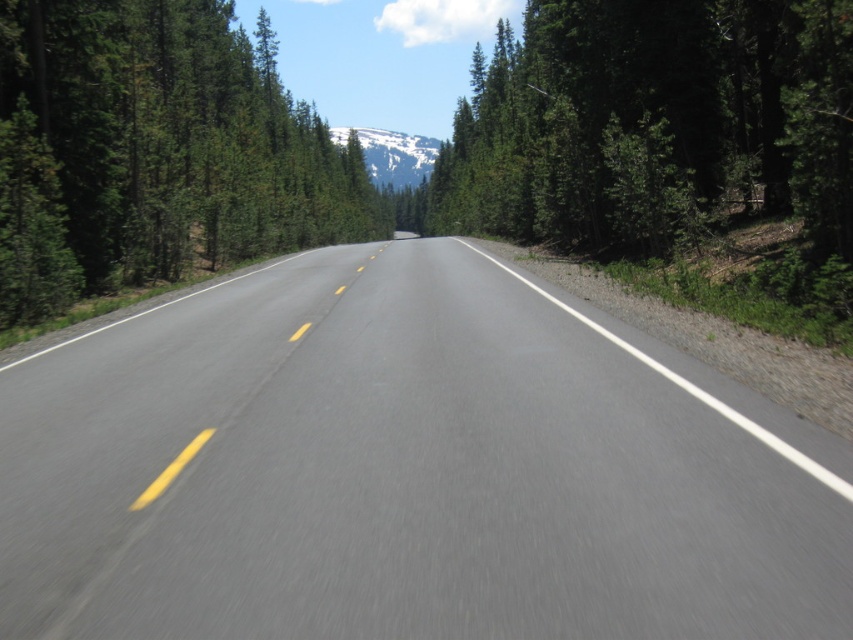
Question: Which of the following is the closest to the observer?

Choices:
 (A) snowy white mountain at center
 (B) green matte tree at left

Answer: (B)

Question: Which of the following is the farthest from the observer?

Choices:
 (A) (598, 572)
 (B) (427, 150)

Answer: (B)

Question: Where is smooth asphalt road at center located in relation to snowy white mountain at center in the image?

Choices:
 (A) right
 (B) left

Answer: (A)

Question: Is smooth asphalt road at center behind green matte tree at left?

Choices:
 (A) yes
 (B) no

Answer: (B)

Question: Which point is closer to the camera?

Choices:
 (A) (328, 276)
 (B) (335, 230)

Answer: (A)

Question: Is smooth asphalt road at center to the left of green matte tree at left from the viewer's perspective?

Choices:
 (A) yes
 (B) no

Answer: (B)